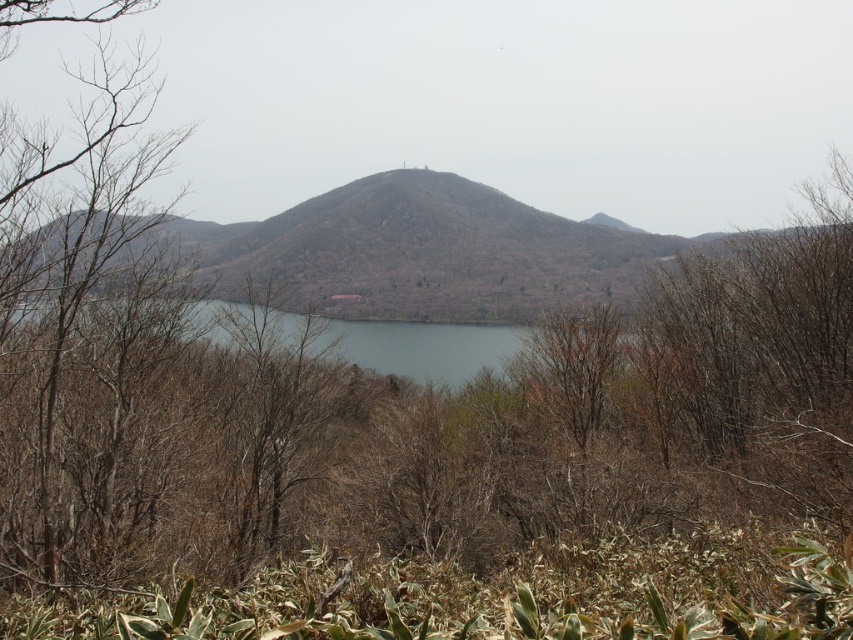
Who is positioned more to the left, brown textured hill at center or clear water at center?

clear water at center

Describe the element at coordinates (445, 250) in the screenshot. I see `brown textured hill at center` at that location.

Where is `brown textured hill at center`? This screenshot has height=640, width=853. brown textured hill at center is located at coordinates (445, 250).